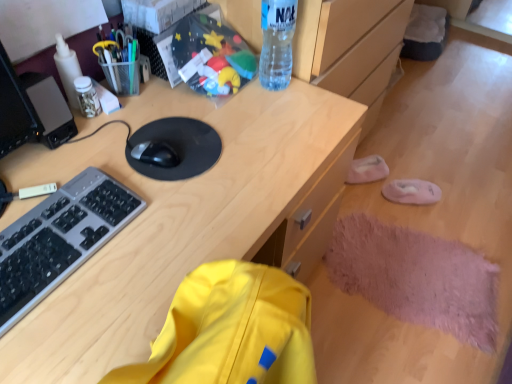
Where is `vacant space to the right of transparent plastic bottle at upper center, positioned as the first bottle in right-to-left order`? The width and height of the screenshot is (512, 384). vacant space to the right of transparent plastic bottle at upper center, positioned as the first bottle in right-to-left order is located at coordinates tap(315, 92).